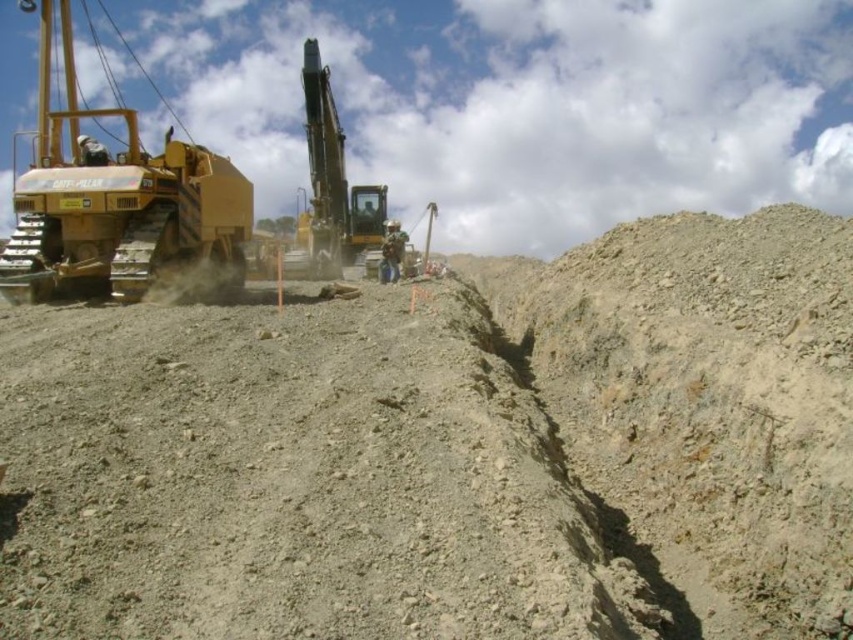
Question: Can you confirm if yellow metallic excavator at center is smaller than camouflage fabric construction worker at center?

Choices:
 (A) yes
 (B) no

Answer: (B)

Question: Is matte yellow bulldozer at left smaller than yellow metallic excavator at center?

Choices:
 (A) no
 (B) yes

Answer: (A)

Question: Can you confirm if yellow metallic excavator at center is thinner than camouflage fabric construction worker at center?

Choices:
 (A) no
 (B) yes

Answer: (A)

Question: Which of the following is the farthest from the observer?

Choices:
 (A) (173, 189)
 (B) (358, 188)
 (C) (392, 256)

Answer: (B)

Question: Which object is closer to the camera taking this photo?

Choices:
 (A) yellow metallic excavator at center
 (B) matte yellow bulldozer at left

Answer: (B)

Question: Which point is farther to the camera?

Choices:
 (A) tap(381, 246)
 (B) tap(317, 100)

Answer: (A)